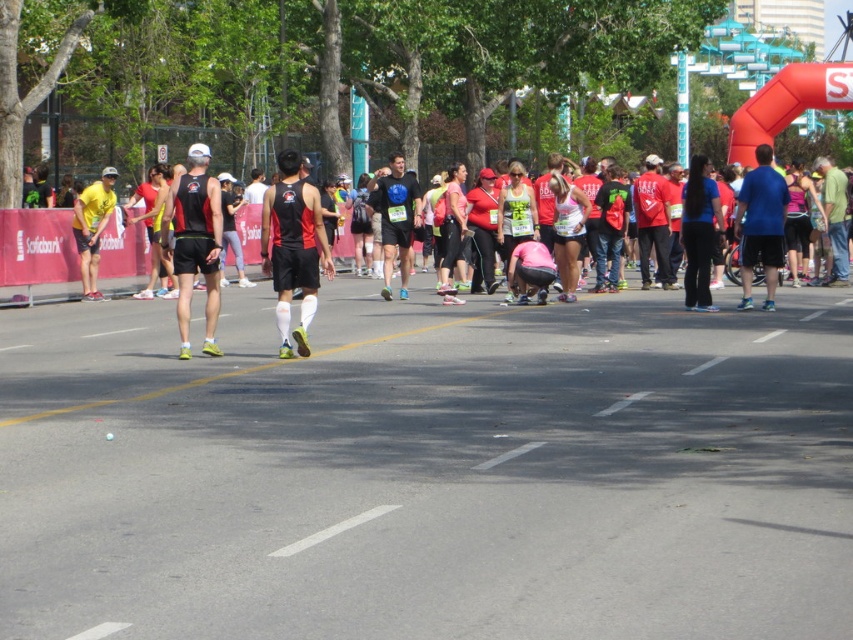
Question: Estimate the real-world distances between objects in this image. Which object is closer to the matte black tank top at center?

Choices:
 (A) black athletic wear at center
 (B) yellow matte tank top at left

Answer: (A)

Question: Does black athletic wear at center appear under yellow matte tank top at left?

Choices:
 (A) no
 (B) yes

Answer: (B)

Question: Is black athletic wear at center to the left of matte black tank top at center from the viewer's perspective?

Choices:
 (A) no
 (B) yes

Answer: (A)

Question: Which of the following is the farthest from the observer?

Choices:
 (A) yellow matte tank top at left
 (B) matte black tank top at center
 (C) black athletic wear at center

Answer: (A)

Question: Does black athletic wear at center appear on the right side of matte black tank top at center?

Choices:
 (A) no
 (B) yes

Answer: (B)

Question: Which object appears closest to the camera in this image?

Choices:
 (A) yellow matte tank top at left
 (B) matte black tank top at center
 (C) black athletic wear at center

Answer: (B)